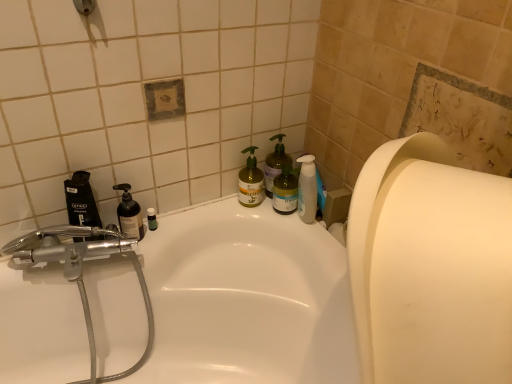
Where is `vacant space to the right of matte black pump bottle at left, the third cleaning product from the right`? The width and height of the screenshot is (512, 384). vacant space to the right of matte black pump bottle at left, the third cleaning product from the right is located at coordinates (178, 230).